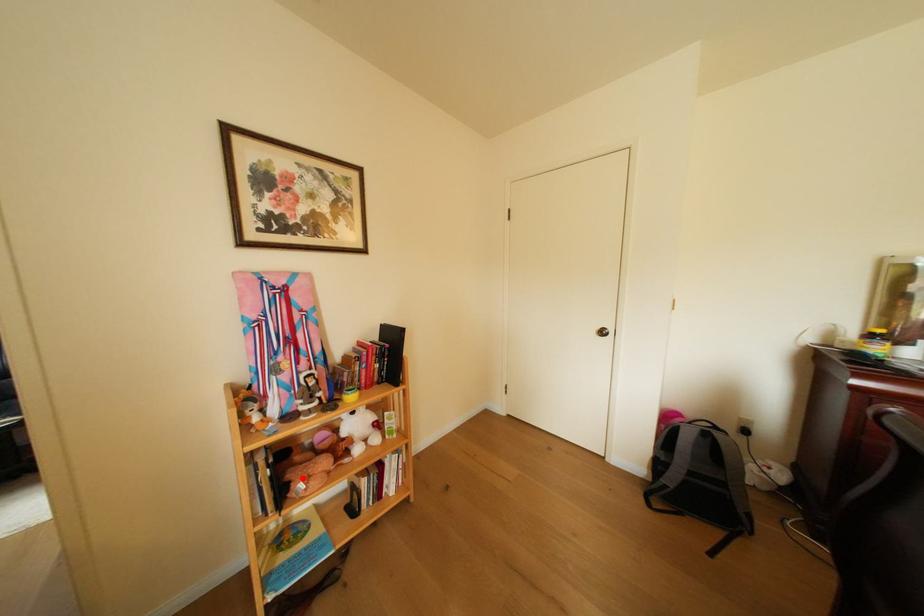
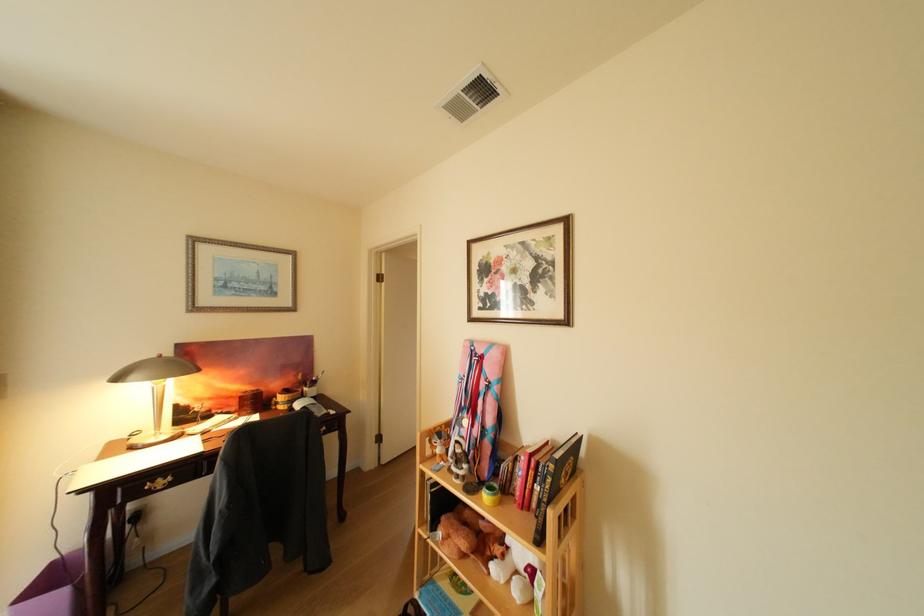
Question: I am providing you with two images of the same scene from different viewpoints. Given a red point in image1, look at the same physical point in image2. Is it:

Choices:
 (A) Closer to the viewpoint
 (B) Farther from the viewpoint

Answer: (B)